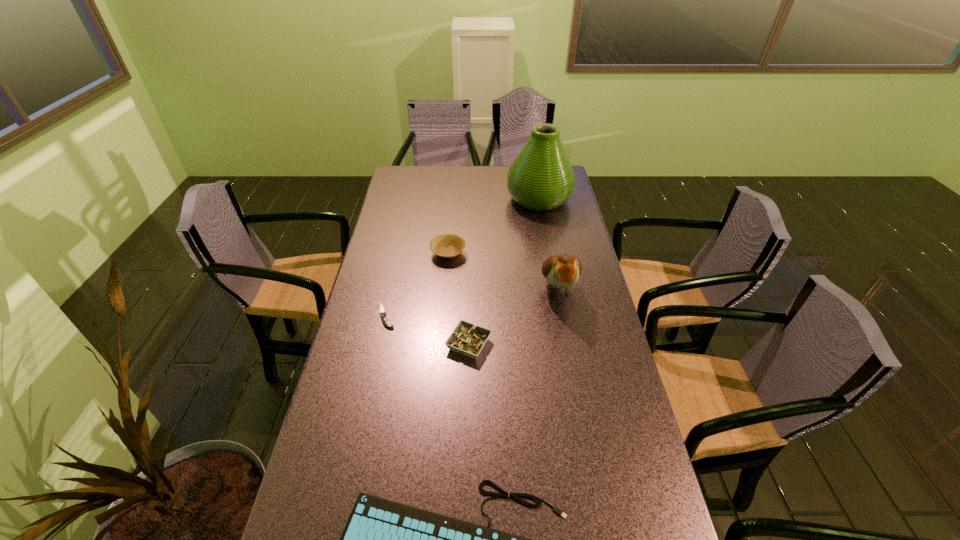
I want to click on the tallest object, so click(541, 178).

I want to click on the farthest object, so click(x=541, y=178).

Locate an element on the screen. The width and height of the screenshot is (960, 540). the fifth shortest object is located at coordinates point(562,271).

Where is `the fifth nearest object`? This screenshot has height=540, width=960. the fifth nearest object is located at coordinates (447, 246).

Image resolution: width=960 pixels, height=540 pixels. I want to click on the fourth shortest object, so click(x=447, y=246).

Locate an element on the screen. This screenshot has width=960, height=540. ashtray is located at coordinates (467, 339).

Locate an element on the screen. The height and width of the screenshot is (540, 960). the shortest object is located at coordinates 382,312.

The image size is (960, 540). I want to click on vacant space located 0.130m on the back of the tallest object, so click(534, 168).

In order to click on vacant region located at the face of the bird in this screenshot , I will do `click(584, 427)`.

The width and height of the screenshot is (960, 540). Find the location of `vacant space located on the right of the third tallest object`. vacant space located on the right of the third tallest object is located at coordinates (536, 253).